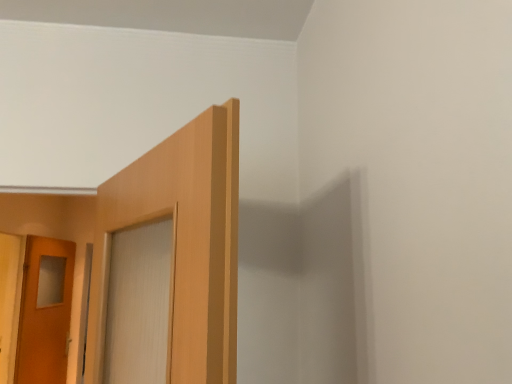
This screenshot has width=512, height=384. I want to click on matte wooden door at left, so click(45, 311).

Describe the element at coordinates (45, 311) in the screenshot. This screenshot has height=384, width=512. I see `matte wooden door at left` at that location.

Where is `matte wooden door at left`? The width and height of the screenshot is (512, 384). matte wooden door at left is located at coordinates (45, 311).